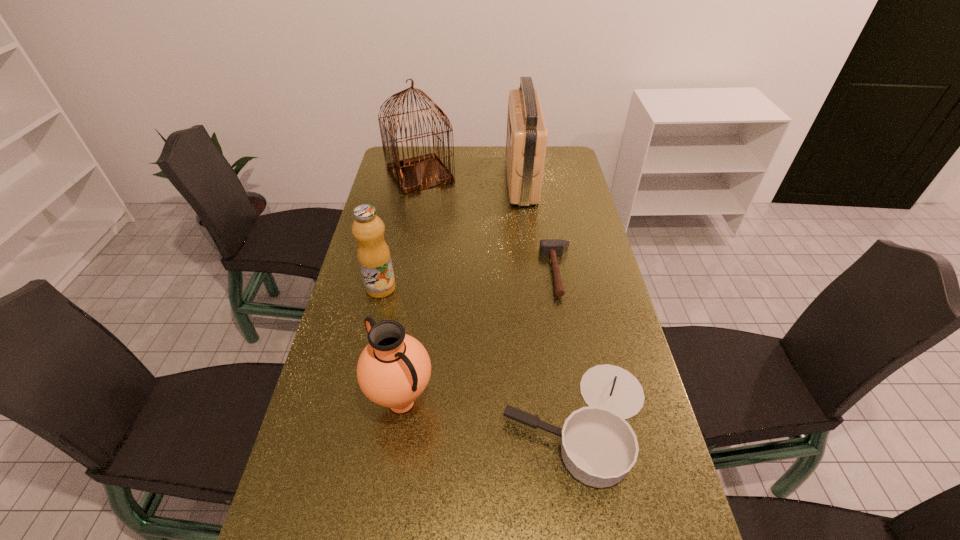
Where is `birdcage`? birdcage is located at coordinates (413, 174).

Identify the location of radio receiver. (526, 142).

This screenshot has height=540, width=960. In order to click on fruit juice in this screenshot , I will do `click(373, 253)`.

The height and width of the screenshot is (540, 960). I want to click on pitcher, so click(x=393, y=370).

Locate an element on the screen. saucepan is located at coordinates click(598, 447).

Where is `the shortest object`? the shortest object is located at coordinates (548, 247).

Where is `vacant area located 0.400m on the right of the birdcage`? This screenshot has height=540, width=960. vacant area located 0.400m on the right of the birdcage is located at coordinates (551, 175).

Identify the location of free space located on the front-facing side of the radio receiver. [x=434, y=180].

Locate an element on the screen. The width and height of the screenshot is (960, 540). vacant space located on the front-facing side of the radio receiver is located at coordinates (421, 180).

At what (x,y) coordinates should I click in order to perform the action: click on vacant region located on the front-facing side of the radio receiver. Please return your answer as a coordinate pair (x, y). Image resolution: width=960 pixels, height=540 pixels. Looking at the image, I should click on (417, 180).